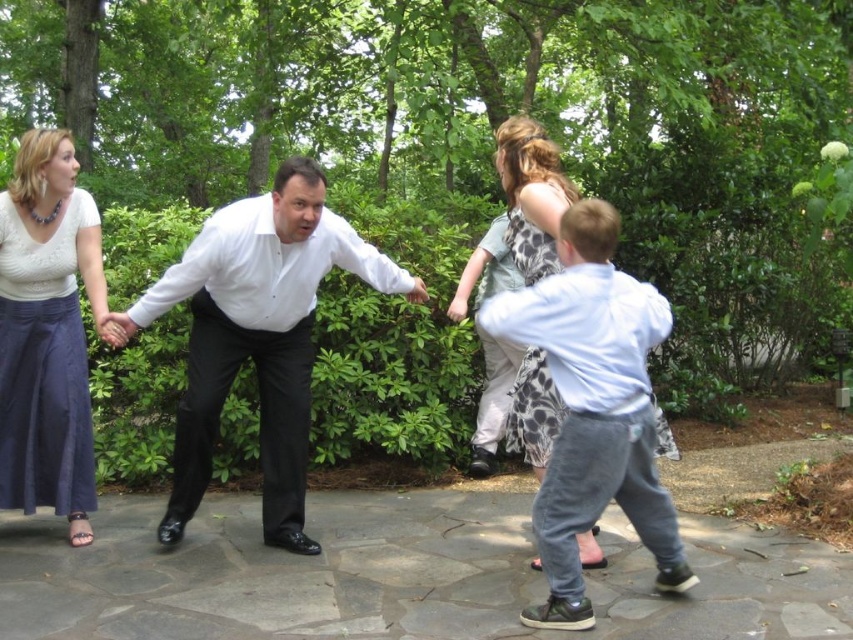
Is the position of light blue shirt at center less distant than that of giraffe print dress at center?

That is True.

Does point (584, 321) come farther from viewer compared to point (509, 211)?

No, (584, 321) is in front of (509, 211).

Does point (556, 353) come closer to viewer compared to point (514, 141)?

Yes, it is.

Find the location of `light blue shirt at center`. light blue shirt at center is located at coordinates (593, 408).

Does point (94, 268) lie behind point (289, 481)?

That is False.

Between white shirt at center and white glossy shirt at center, which one appears on the right side from the viewer's perspective?

Positioned to the right is white glossy shirt at center.

Identify the location of white shirt at center. (250, 333).

From the picture: Does white glossy shirt at center appear on the right side of light blue shirt at center?

No, white glossy shirt at center is not to the right of light blue shirt at center.

Does white glossy shirt at center have a greater width compared to light blue shirt at center?

Correct, the width of white glossy shirt at center exceeds that of light blue shirt at center.

Between point (227, 246) and point (572, 406), which one is positioned behind?

The point (227, 246) is more distant.

Where is `white glossy shirt at center`? The image size is (853, 640). white glossy shirt at center is located at coordinates (256, 336).